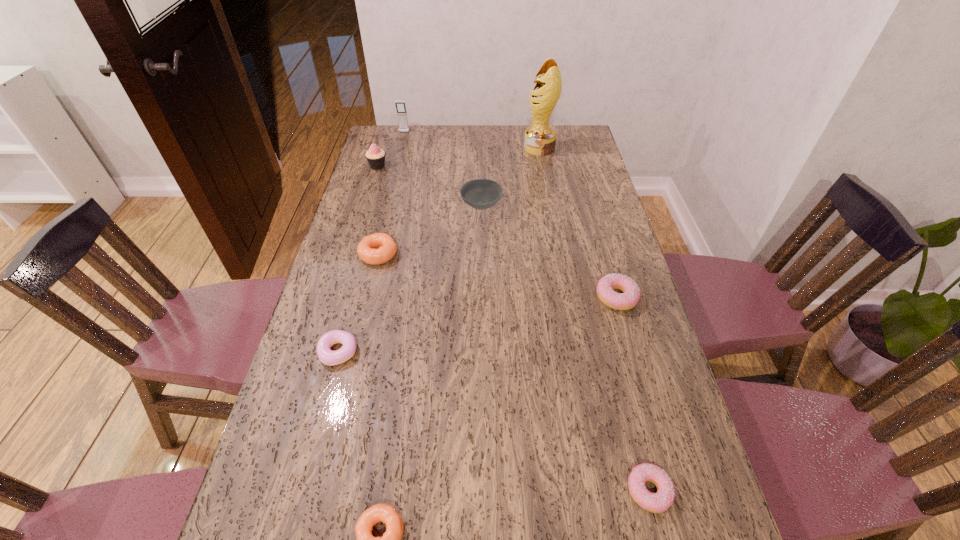
Identify the location of object located in the far left corner section of the desktop. This screenshot has width=960, height=540. (400, 105).

Where is `object present at the far right corner`? The height and width of the screenshot is (540, 960). object present at the far right corner is located at coordinates (540, 138).

You are a GUI agent. You are given a task and a screenshot of the screen. Output one action in this format:
    pyautogui.click(x=<x>, y=<y>)
    Task: Click on the blank space at the far edge
    This screenshot has width=960, height=540.
    Given the screenshot: What is the action you would take?
    pyautogui.click(x=479, y=136)

In the image, there is a desktop. At what (x,y) coordinates should I click in order to perform the action: click on vacant space at the left edge. Please return your answer as a coordinate pair (x, y). Image resolution: width=960 pixels, height=540 pixels. Looking at the image, I should click on (372, 222).

You are a GUI agent. You are given a task and a screenshot of the screen. Output one action in this format:
    pyautogui.click(x=<x>, y=<y>)
    Task: Click on the free spot at the right edge of the desktop
    The height and width of the screenshot is (540, 960).
    Given the screenshot: What is the action you would take?
    pyautogui.click(x=597, y=247)

In order to click on vacant space at the far left corner of the desktop in this screenshot , I will do point(401,137).

At what (x,y) coordinates should I click in order to perform the action: click on free region at the far right corner. Please return your answer as a coordinate pair (x, y). The image size is (960, 540). Looking at the image, I should click on (583, 150).

This screenshot has width=960, height=540. What are the coordinates of `free area in between the seventh nearest object and the tallest object` in the screenshot? It's located at (458, 157).

I want to click on vacant space that's between the farthest object and the sixth object from left to right, so pyautogui.click(x=443, y=169).

At what (x,y) coordinates should I click in order to perform the action: click on blank region between the fourth farthest object and the nearer pink doughnut. Please return your answer as a coordinate pair (x, y). This screenshot has height=540, width=960. Looking at the image, I should click on (565, 348).